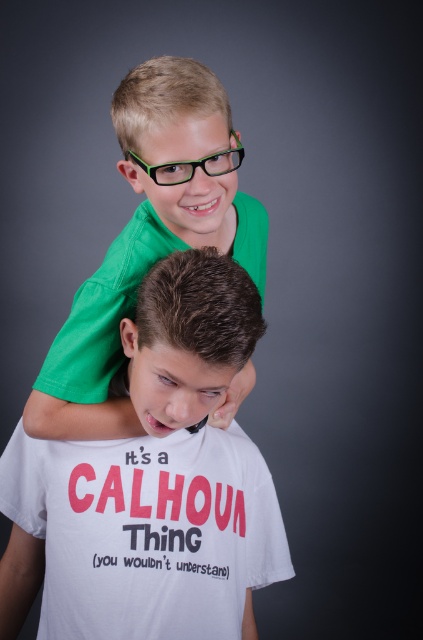
Does white cotton t-shirt at center appear on the right side of brown matte hair at center?

Incorrect, white cotton t-shirt at center is not on the right side of brown matte hair at center.

How much distance is there between white cotton t-shirt at center and brown matte hair at center?

white cotton t-shirt at center and brown matte hair at center are 20.81 centimeters apart from each other.

Identify the location of white cotton t-shirt at center. (147, 531).

Is point (165, 337) positioned before point (219, 168)?

Yes, point (165, 337) is in front of point (219, 168).

Between brown matte hair at center and green plastic glasses at upper center, which one appears on the left side from the viewer's perspective?

From the viewer's perspective, brown matte hair at center appears more on the left side.

Find the location of a particular element. brown matte hair at center is located at coordinates (189, 337).

Does green matte glasses at upper center appear on the right side of green plastic glasses at upper center?

No, green matte glasses at upper center is not to the right of green plastic glasses at upper center.

Does point (139, 188) come behind point (161, 168)?

Yes.

Find the location of a particular element. The height and width of the screenshot is (640, 423). green matte glasses at upper center is located at coordinates (164, 99).